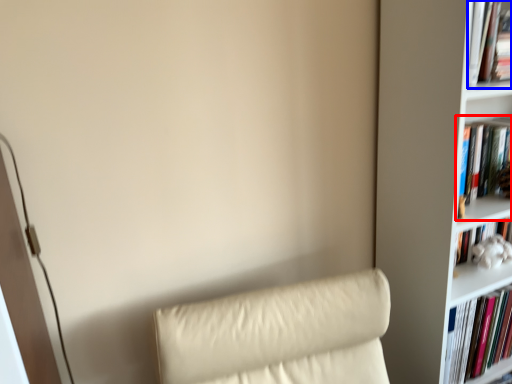
Question: Which of the following is the farthest to the observer, book (highlighted by a red box) or book (highlighted by a blue box)?

Choices:
 (A) book
 (B) book

Answer: (A)